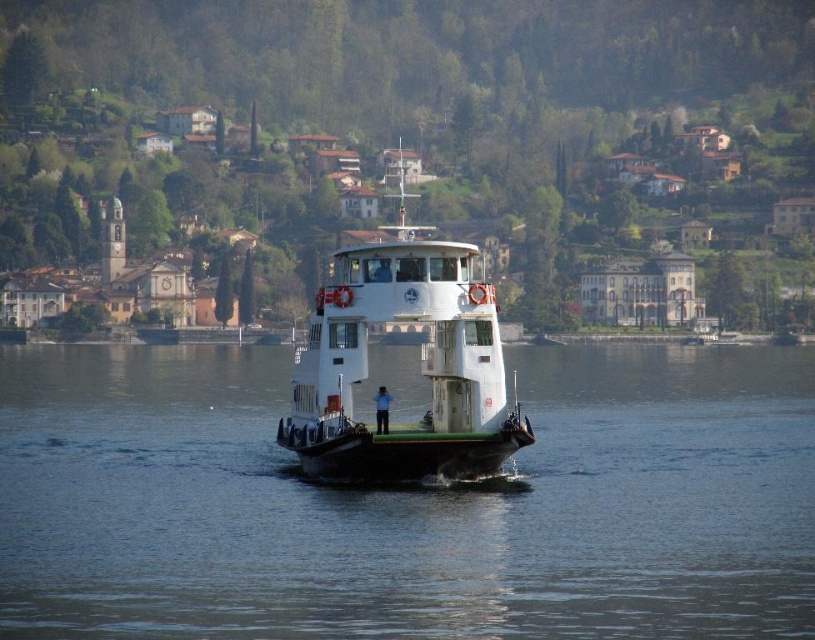
In the scene shown: You are a photographer planning to capture the entire ferryboat and the water in one shot. Given that your camera can only focus on objects within a 10m width, can you fit both the white matte ferryboat at center and the clear water at center into the frame?

The clear water at center is wider than the white matte ferryboat at center. Since the camera can focus on objects within a 10m width, and the ferryboat is narrower than the water, both can fit into the frame as their combined width does not exceed the camera limit.